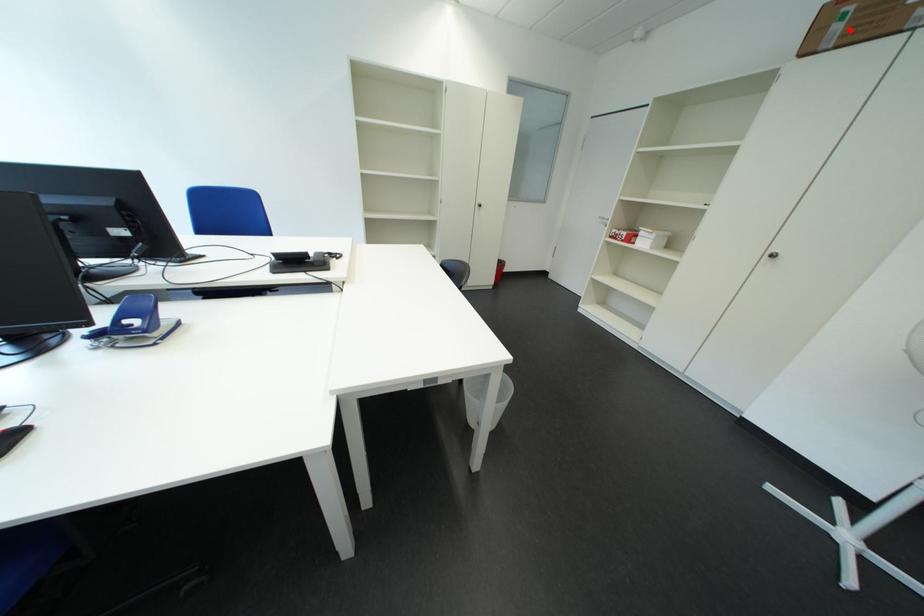
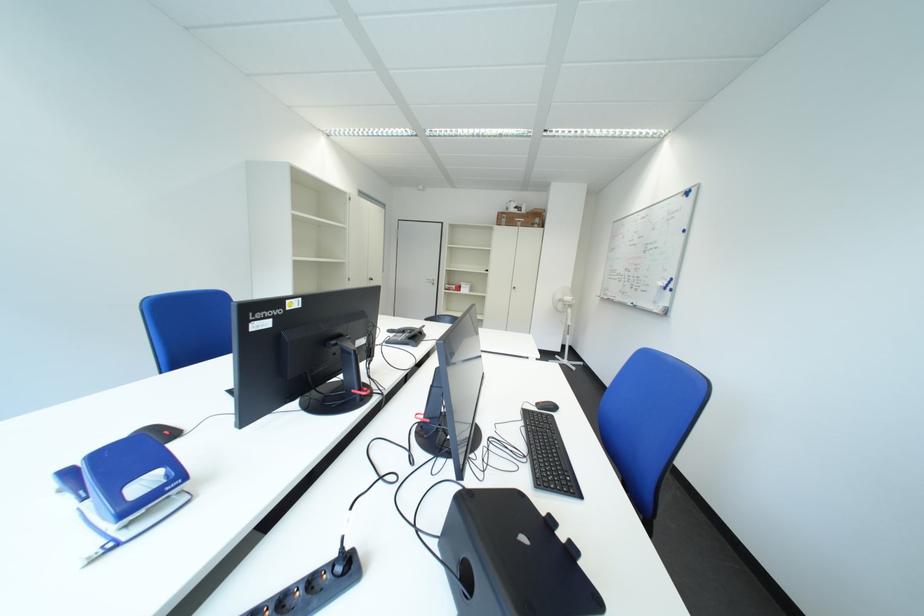
The point at the highlighted location is marked in the first image. Where is the corresponding point in the second image?

(517, 223)